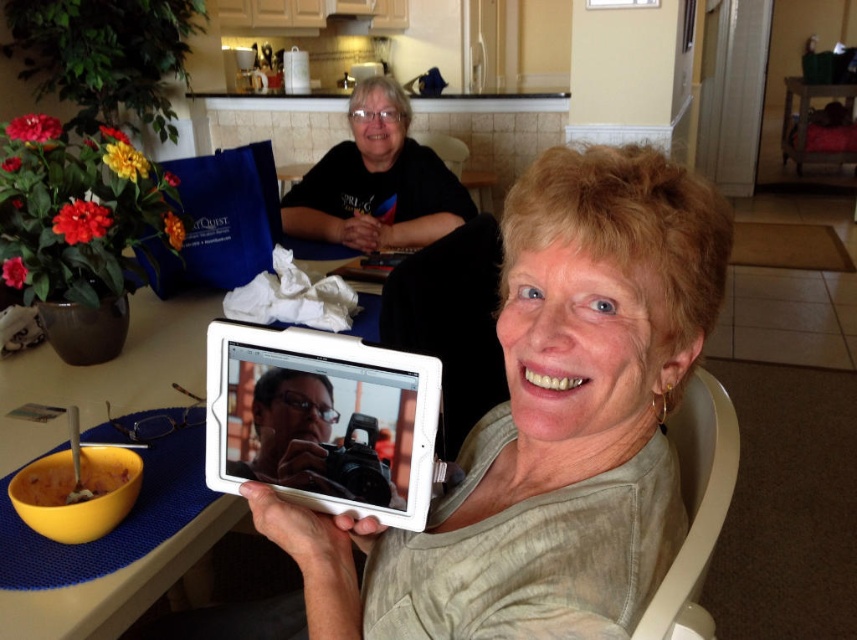
Who is more distant from viewer, (208, 326) or (375, 88)?

Positioned behind is point (375, 88).

Does white matte tablet computer at center appear on the right side of black matte shirt at upper center?

Correct, you'll find white matte tablet computer at center to the right of black matte shirt at upper center.

Between point (405, 524) and point (379, 184), which one is positioned behind?

The point (379, 184) is more distant.

Locate an element on the screen. white matte tablet computer at center is located at coordinates (321, 419).

Measure the distance between white plastic chair at lower right and orange matte bowl at lower left.

white plastic chair at lower right and orange matte bowl at lower left are 29.14 inches apart from each other.

Which is below, white plastic chair at lower right or orange matte bowl at lower left?

Positioned lower is orange matte bowl at lower left.

Locate an element on the screen. The width and height of the screenshot is (857, 640). white plastic chair at lower right is located at coordinates click(696, 506).

In order to click on white plastic chair at lower right in this screenshot , I will do `click(696, 506)`.

From the picture: Can you confirm if orange matte bowl at lower left is positioned below yellow plastic bowl at lower left?

Yes, orange matte bowl at lower left is below yellow plastic bowl at lower left.

This screenshot has height=640, width=857. Describe the element at coordinates (78, 480) in the screenshot. I see `orange matte bowl at lower left` at that location.

Who is more distant from viewer, (109, 458) or (45, 614)?

The point (109, 458) is more distant.

Where is `orange matte bowl at lower left`? This screenshot has height=640, width=857. orange matte bowl at lower left is located at coordinates (78, 480).